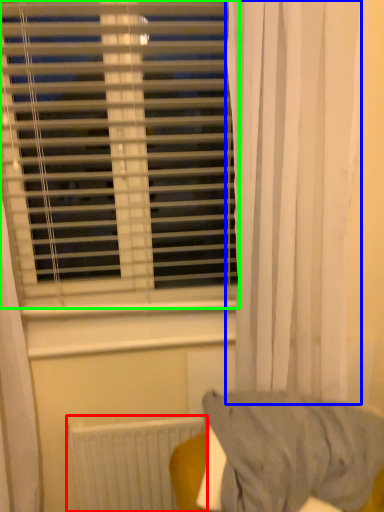
Question: Considering the real-world distances, which object is closest to radiator (highlighted by a red box)? curtain (highlighted by a blue box) or window blind (highlighted by a green box).

Choices:
 (A) curtain
 (B) window blind

Answer: (A)